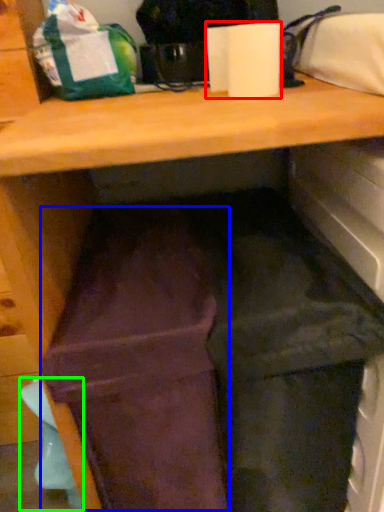
Question: Considering the real-world distances, which object is farthest from paper towel (highlighted by a red box)? wide (highlighted by a blue box) or waste (highlighted by a green box)?

Choices:
 (A) wide
 (B) waste

Answer: (B)